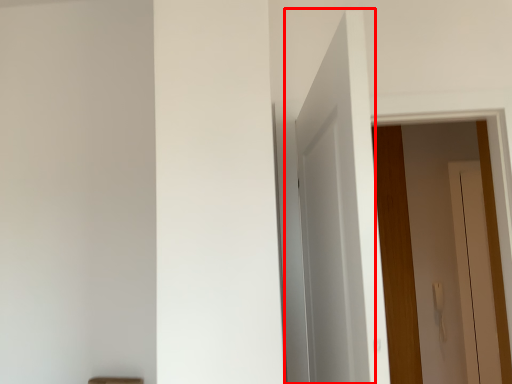
Question: From the image's perspective, where is door (annotated by the red box) located relative to door?

Choices:
 (A) below
 (B) above

Answer: (B)